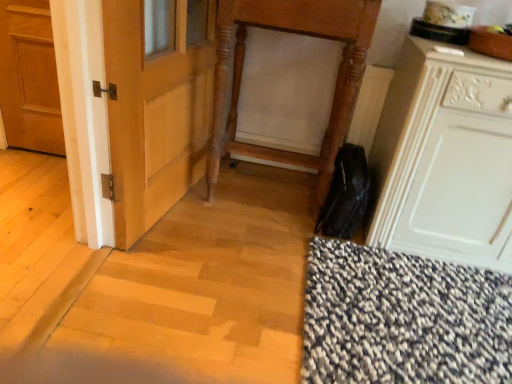
Question: Should I look upward or downward to see white matte cabinet at lower right?

Choices:
 (A) down
 (B) up

Answer: (B)

Question: Does white matte cabinet at lower right lie behind wooden carved vanity at center?

Choices:
 (A) no
 (B) yes

Answer: (A)

Question: Is white matte cabinet at lower right positioned beyond the bounds of wooden carved vanity at center?

Choices:
 (A) yes
 (B) no

Answer: (A)

Question: From a real-world perspective, is white matte cabinet at lower right on wooden carved vanity at center?

Choices:
 (A) yes
 (B) no

Answer: (B)

Question: Is white matte cabinet at lower right taller than wooden carved vanity at center?

Choices:
 (A) no
 (B) yes

Answer: (A)

Question: Can you confirm if white matte cabinet at lower right is thinner than wooden carved vanity at center?

Choices:
 (A) yes
 (B) no

Answer: (B)

Question: Is wooden carved vanity at center located within white matte cabinet at lower right?

Choices:
 (A) yes
 (B) no

Answer: (B)

Question: Is white matte cabinet at lower right to the right of matte wooden door at left from the viewer's perspective?

Choices:
 (A) no
 (B) yes

Answer: (B)

Question: Is white matte cabinet at lower right closer to camera compared to matte wooden door at left?

Choices:
 (A) no
 (B) yes

Answer: (B)

Question: Considering the relative sizes of white matte cabinet at lower right and matte wooden door at left in the image provided, is white matte cabinet at lower right smaller than matte wooden door at left?

Choices:
 (A) no
 (B) yes

Answer: (A)

Question: Is matte wooden door at left surrounded by white matte cabinet at lower right?

Choices:
 (A) no
 (B) yes

Answer: (A)

Question: Is white matte cabinet at lower right taller than matte wooden door at left?

Choices:
 (A) no
 (B) yes

Answer: (B)

Question: Is white matte cabinet at lower right not close to matte wooden door at left?

Choices:
 (A) yes
 (B) no

Answer: (A)

Question: Is the depth of matte wooden door at left greater than that of white matte cabinet at lower right?

Choices:
 (A) yes
 (B) no

Answer: (A)